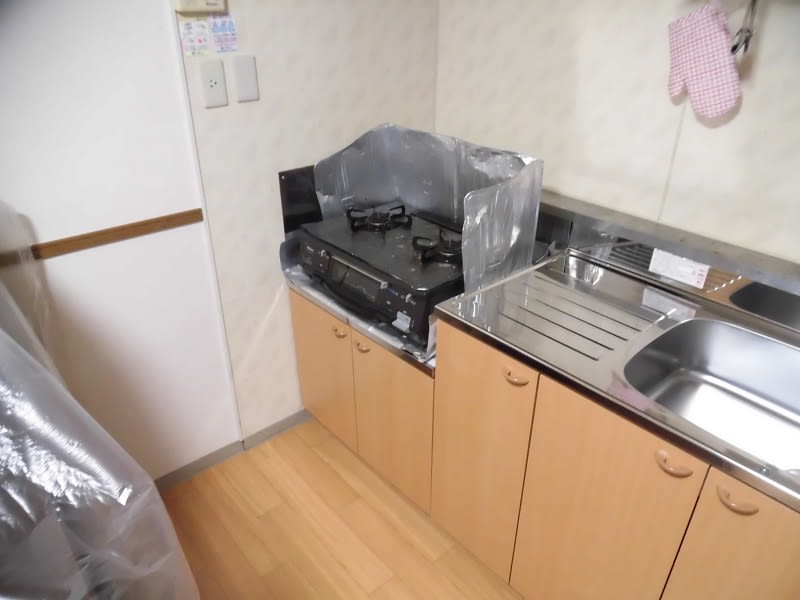
What are the coordinates of `wall` in the screenshot? It's located at (52, 143), (548, 69), (350, 71).